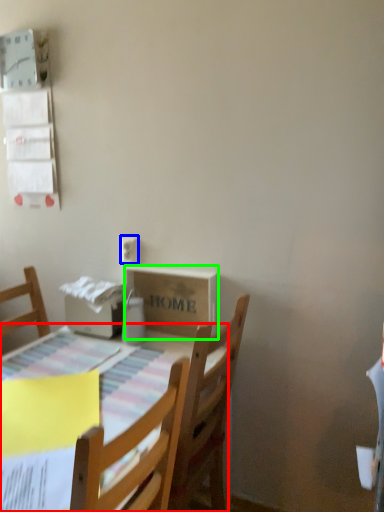
Question: Based on their relative distances, which object is farther from table (highlighted by a red box)? Choose from electric outlet (highlighted by a blue box) and cardboard box (highlighted by a green box).

Choices:
 (A) electric outlet
 (B) cardboard box

Answer: (A)